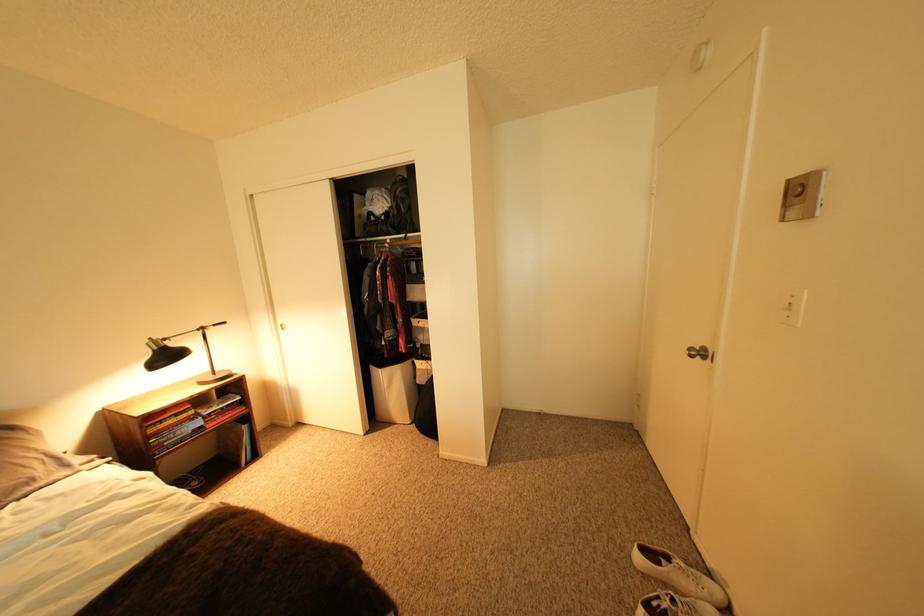
Where would you slid the thermostat lever? Please return your answer as a coordinate pair (x, y).

(820, 203)